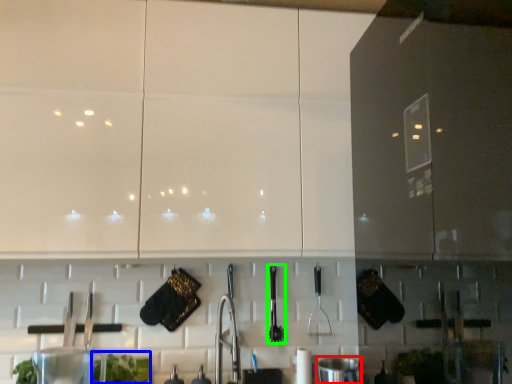
Question: Considering the real-world distances, which object is closest to appliance (highlighted by a red box)? plant (highlighted by a blue box) or silverware (highlighted by a green box).

Choices:
 (A) plant
 (B) silverware

Answer: (B)